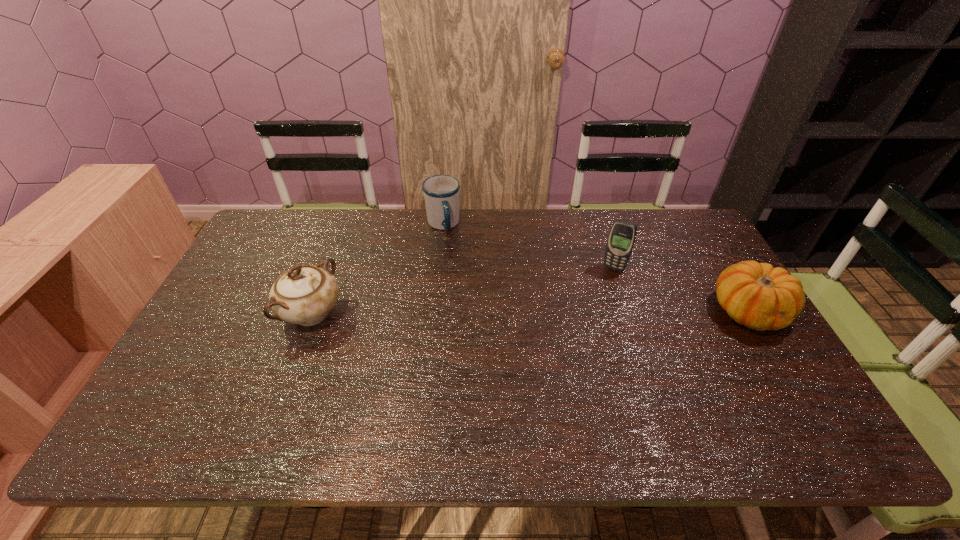
Find the location of a particular element. The width and height of the screenshot is (960, 540). free space on the desktop that is between the leftmost object and the gourd and is positioned on the handle side of the mug is located at coordinates (480, 313).

Identify the location of vacant space on the desktop that is between the chinaware and the gourd and is positioned on the screen of the third object from left to right. The image size is (960, 540). (591, 312).